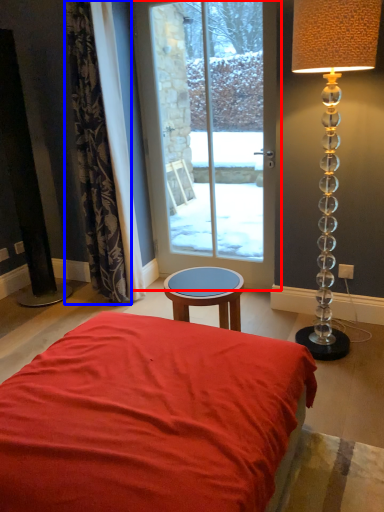
Question: Which object appears closest to the camera in this image, door (highlighted by a red box) or curtain (highlighted by a blue box)?

Choices:
 (A) door
 (B) curtain

Answer: (B)